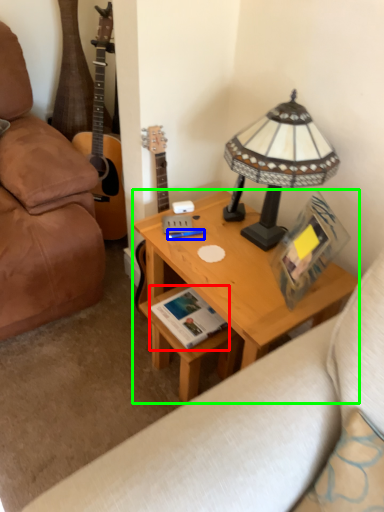
Question: Considering the real-world distances, which object is farthest from book (highlighted by a red box)? pen (highlighted by a blue box) or desk (highlighted by a green box)?

Choices:
 (A) pen
 (B) desk

Answer: (A)